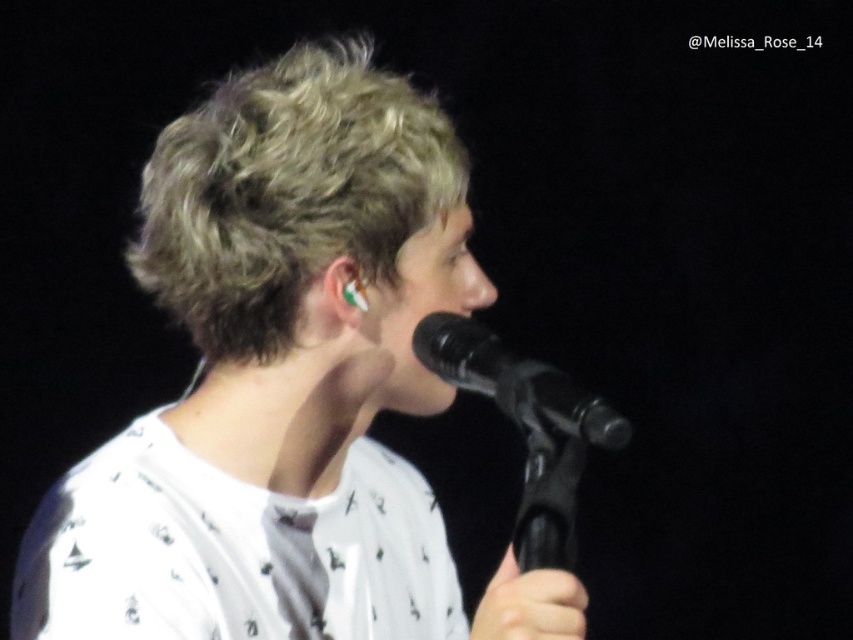
Question: Can you confirm if blonde curly hair at center is smaller than black matte microphone at center?

Choices:
 (A) no
 (B) yes

Answer: (A)

Question: Which object appears farthest from the camera in this image?

Choices:
 (A) black matte microphone at center
 (B) blonde curly hair at center

Answer: (B)

Question: Is blonde curly hair at center above black matte microphone at center?

Choices:
 (A) yes
 (B) no

Answer: (A)

Question: Which point is farther from the camera taking this photo?

Choices:
 (A) (334, 244)
 (B) (433, 314)

Answer: (B)

Question: Which point is closer to the camera taking this photo?

Choices:
 (A) (241, 228)
 (B) (422, 317)

Answer: (A)

Question: Can you confirm if blonde curly hair at center is wider than black matte microphone at center?

Choices:
 (A) yes
 (B) no

Answer: (A)